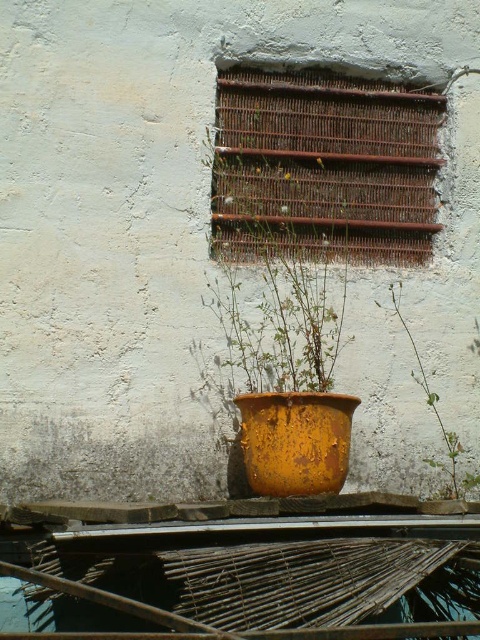
Question: Which point appears farthest from the camera in this image?

Choices:
 (A) (273, 472)
 (B) (455, 465)

Answer: (B)

Question: Is rusty metal pot at center thinner than green leafy plant at center?

Choices:
 (A) yes
 (B) no

Answer: (B)

Question: Is rusty metal pot at center thinner than green leafy plant at center?

Choices:
 (A) no
 (B) yes

Answer: (A)

Question: Can you confirm if rusty metal pot at center is smaller than green leafy plant at center?

Choices:
 (A) yes
 (B) no

Answer: (A)

Question: Which of the following is the closest to the observer?

Choices:
 (A) green leafy plant at center
 (B) rusty metal pot at center

Answer: (B)